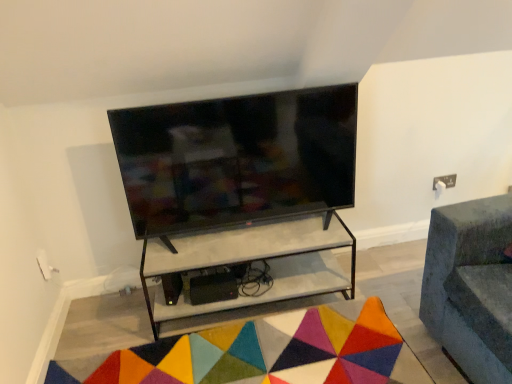
Describe the element at coordinates (264, 353) in the screenshot. This screenshot has width=512, height=384. I see `multicolored felt mat at lower center` at that location.

What do you see at coordinates (236, 159) in the screenshot? I see `matte black tv at center` at bounding box center [236, 159].

Identify the location of multicolored felt mat at lower center. (264, 353).

Can you confirm if multicolored felt mat at lower center is taller than white marble shelf at center?

No, multicolored felt mat at lower center is not taller than white marble shelf at center.

Is multicolored felt mat at lower center wider or thinner than white marble shelf at center?

Clearly, multicolored felt mat at lower center has more width compared to white marble shelf at center.

This screenshot has height=384, width=512. Find the location of `mat in front of the white marble shelf at center`. mat in front of the white marble shelf at center is located at coordinates (264, 353).

What's the angular difference between multicolored felt mat at lower center and white marble shelf at center's facing directions?

The angular difference between multicolored felt mat at lower center and white marble shelf at center is 0.889 degrees.

Between white marble shelf at center and multicolored felt mat at lower center, which one has smaller size?

Smaller between the two is multicolored felt mat at lower center.

Does point (197, 234) appear closer or farther from the camera than point (353, 350)?

Point (197, 234) is farther from the camera than point (353, 350).

How much distance is there between white marble shelf at center and multicolored felt mat at lower center?

white marble shelf at center is 10.93 inches away from multicolored felt mat at lower center.

Locate an element on the screen. The width and height of the screenshot is (512, 384). shelf behind the multicolored felt mat at lower center is located at coordinates (252, 261).

Can we say matte black tv at center lies outside multicolored felt mat at lower center?

Yes, matte black tv at center is not within multicolored felt mat at lower center.

Does matte black tv at center come behind multicolored felt mat at lower center?

Yes, matte black tv at center is further from the camera.

Measure the distance from matte black tv at center to multicolored felt mat at lower center.

matte black tv at center is 28.10 inches from multicolored felt mat at lower center.

Could you tell me if matte black tv at center is facing multicolored felt mat at lower center?

No, matte black tv at center does not turn towards multicolored felt mat at lower center.

Is matte black tv at center turned away from white marble shelf at center?

matte black tv at center does not have its back to white marble shelf at center.

Is matte black tv at center far away from white marble shelf at center?

No, matte black tv at center is not far from white marble shelf at center.

Which is closer to the camera, (319, 186) or (320, 254)?

The point (319, 186) is more forward.

From the picture: Is matte black tv at center completely or partially outside of white marble shelf at center?

Absolutely, matte black tv at center is external to white marble shelf at center.

Considering the sizes of objects multicolored felt mat at lower center and matte black tv at center in the image provided, who is bigger, multicolored felt mat at lower center or matte black tv at center?

With larger size is matte black tv at center.

Is multicolored felt mat at lower center surrounding matte black tv at center?

Actually, matte black tv at center is outside multicolored felt mat at lower center.

Considering the positions of point (142, 377) and point (259, 104), is point (142, 377) closer or farther from the camera than point (259, 104)?

Clearly, point (142, 377) is closer to the camera than point (259, 104).

Could you tell me if multicolored felt mat at lower center is facing matte black tv at center?

No, multicolored felt mat at lower center is not facing towards matte black tv at center.

I want to click on shelf on the right of matte black tv at center, so click(252, 261).

Considering the relative sizes of white marble shelf at center and matte black tv at center in the image provided, is white marble shelf at center wider than matte black tv at center?

Yes.

Is white marble shelf at center situated inside matte black tv at center or outside?

The correct answer is: outside.

From the image's perspective, is white marble shelf at center located above matte black tv at center?

Incorrect, from the image's perspective, white marble shelf at center is lower than matte black tv at center.

You are a GUI agent. You are given a task and a screenshot of the screen. Output one action in this format:
    pyautogui.click(x=<x>, y=<y>)
    Task: Click on the shelf to the right of multicolored felt mat at lower center
    
    Given the screenshot: What is the action you would take?
    pyautogui.click(x=252, y=261)

At what (x,y) coordinates should I click in order to perform the action: click on shelf located above the multicolored felt mat at lower center (from a real-world perspective). Please return your answer as a coordinate pair (x, y). The width and height of the screenshot is (512, 384). Looking at the image, I should click on (252, 261).

In the scene shown: When comparing their distances from multicolored felt mat at lower center, does white marble shelf at center or matte black tv at center seem further?

matte black tv at center is positioned further to the anchor multicolored felt mat at lower center.

Estimate the real-world distances between objects in this image. Which object is closer to matte black tv at center, multicolored felt mat at lower center or white marble shelf at center?

Among the two, white marble shelf at center is located nearer to matte black tv at center.

When comparing their distances from multicolored felt mat at lower center, does matte black tv at center or white marble shelf at center seem closer?

white marble shelf at center.

Estimate the real-world distances between objects in this image. Which object is further from white marble shelf at center, multicolored felt mat at lower center or matte black tv at center?

Among the two, matte black tv at center is located further to white marble shelf at center.

Estimate the real-world distances between objects in this image. Which object is closer to white marble shelf at center, matte black tv at center or multicolored felt mat at lower center?

multicolored felt mat at lower center is closer to white marble shelf at center.

Looking at the image, which one is located closer to matte black tv at center, white marble shelf at center or multicolored felt mat at lower center?

Based on the image, white marble shelf at center appears to be nearer to matte black tv at center.

Locate an element on the screen. The image size is (512, 384). shelf that lies between matte black tv at center and multicolored felt mat at lower center from top to bottom is located at coordinates (252, 261).